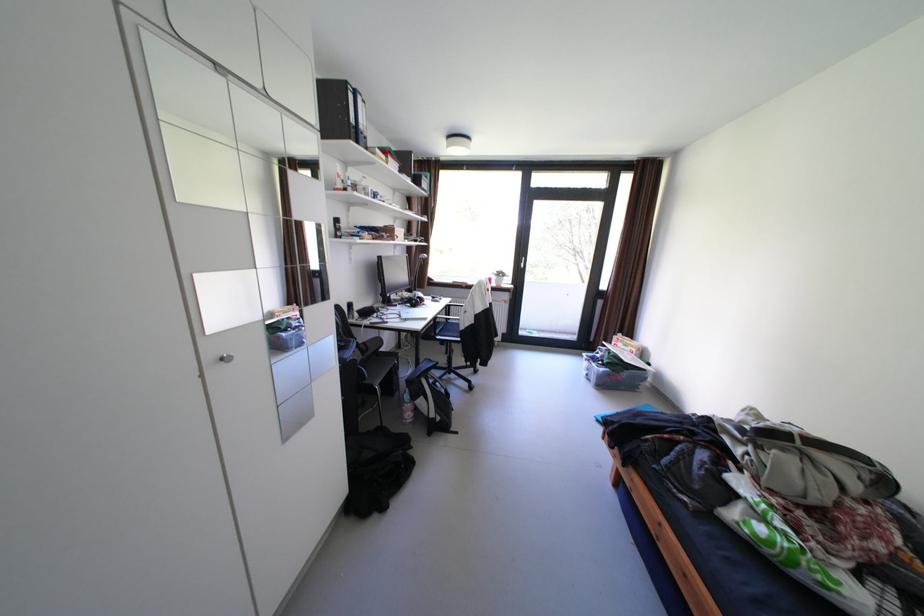
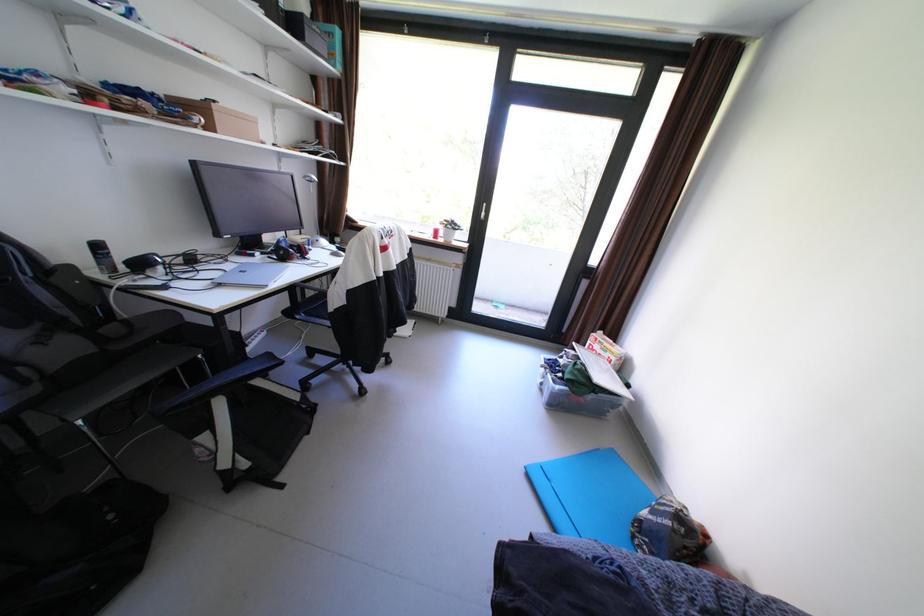
In the second image, find the point that corresponds to point (609, 355) in the first image.

(572, 361)